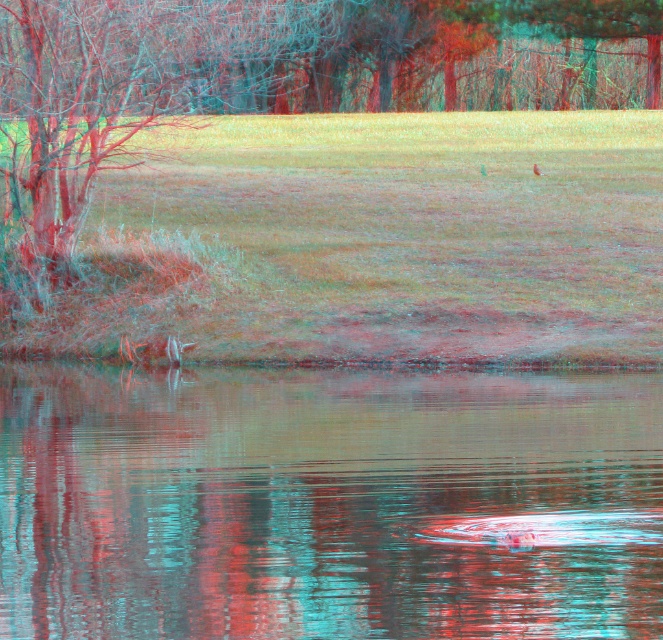
Is point (463, 509) closer to camera compared to point (536, 170)?

Yes, point (463, 509) is closer to viewer.

From the picture: Who is positioned more to the right, clear water at center or brown fuzzy bird at center?

brown fuzzy bird at center

Locate an element on the screen. The width and height of the screenshot is (663, 640). clear water at center is located at coordinates (328, 502).

I want to click on clear water at center, so click(328, 502).

Who is shorter, green grass at center or brown fuzzy bird at center?

Standing shorter between the two is brown fuzzy bird at center.

Is green grass at center below brown fuzzy bird at center?

Incorrect, green grass at center is not positioned below brown fuzzy bird at center.

Is point (107, 316) positioned in front of point (534, 172)?

Yes, point (107, 316) is in front of point (534, 172).

Locate an element on the screen. green grass at center is located at coordinates (365, 244).

Can you confirm if clear water at center is positioned to the right of green grass at center?

No, clear water at center is not to the right of green grass at center.

Is clear water at center closer to camera compared to green grass at center?

Yes.

Image resolution: width=663 pixels, height=640 pixels. What do you see at coordinates (328, 502) in the screenshot?
I see `clear water at center` at bounding box center [328, 502].

You are a GUI agent. You are given a task and a screenshot of the screen. Output one action in this format:
    pyautogui.click(x=<x>, y=<y>)
    Task: Click on the clear water at center
    
    Given the screenshot: What is the action you would take?
    pyautogui.click(x=328, y=502)